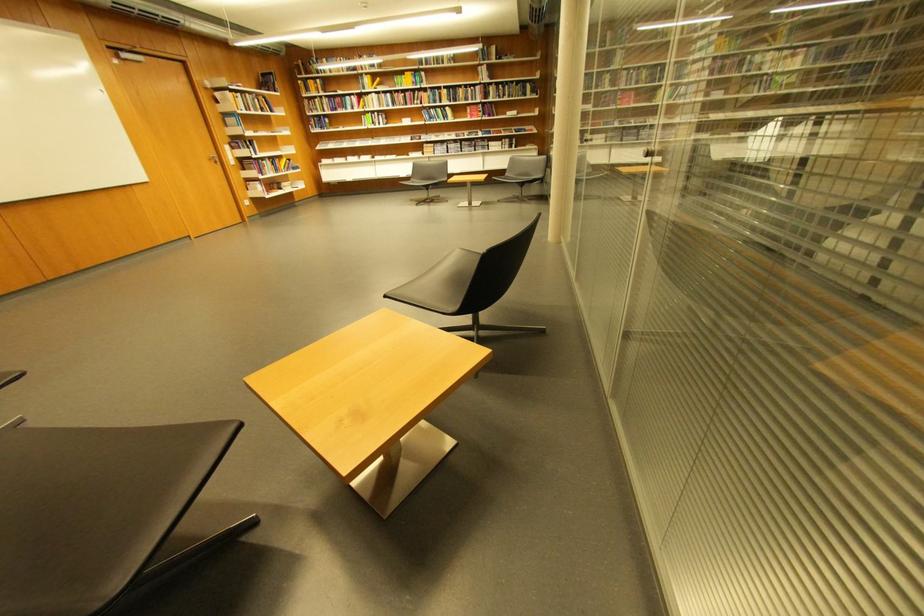
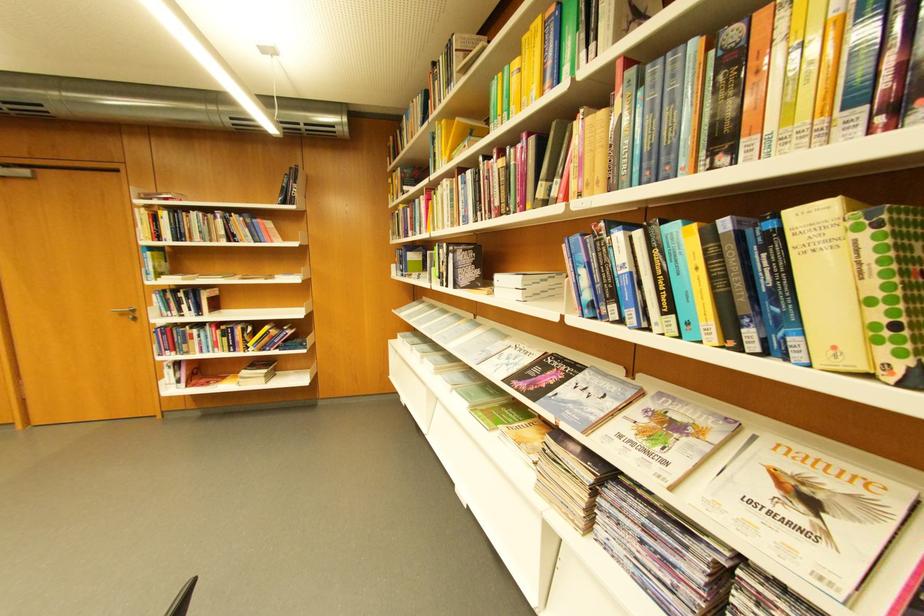
Locate, in the second image, the point that corresponds to point (421, 140) in the first image.

(532, 377)